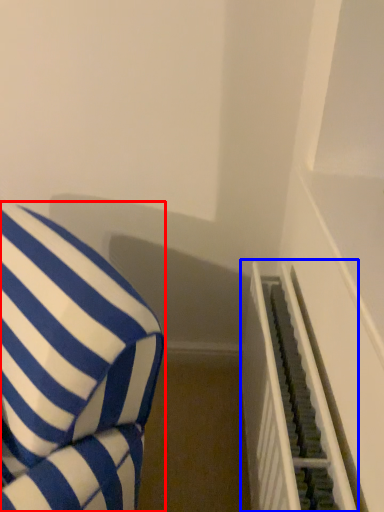
Question: Which object appears closest to the camera in this image, furniture (highlighted by a red box) or stairwell (highlighted by a blue box)?

Choices:
 (A) furniture
 (B) stairwell

Answer: (A)